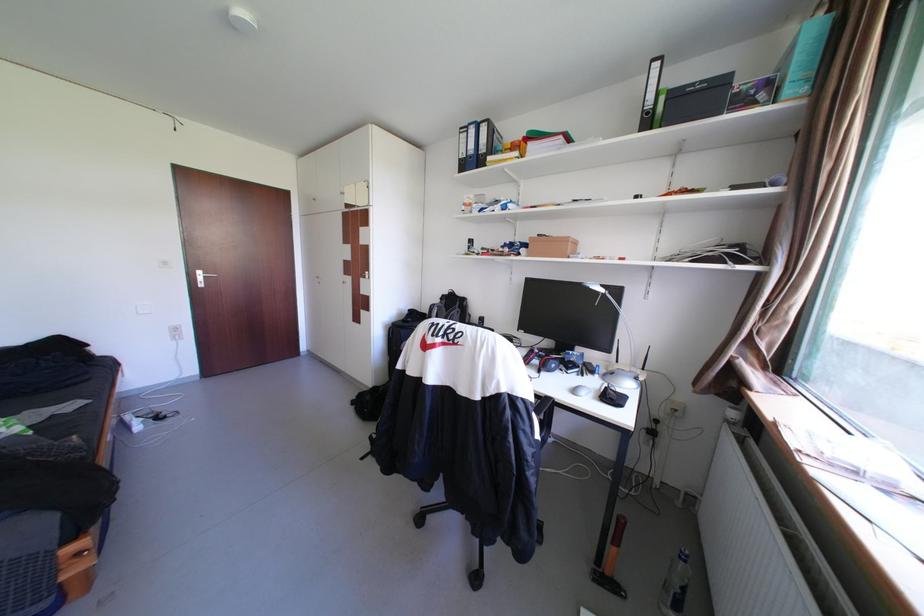
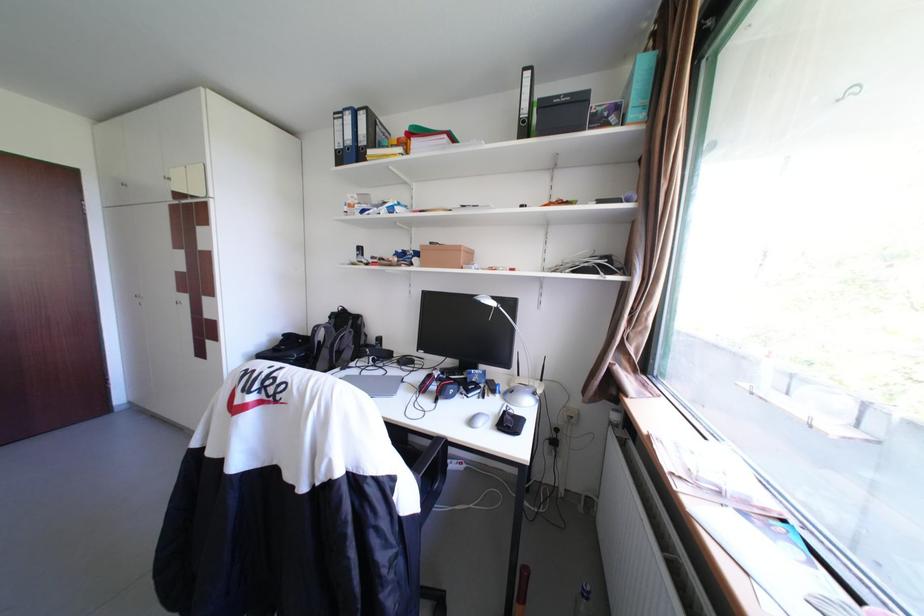
In a continuous first-person perspective shot, in which direction is the camera moving?

The movement direction of the cameraman is right, forward.